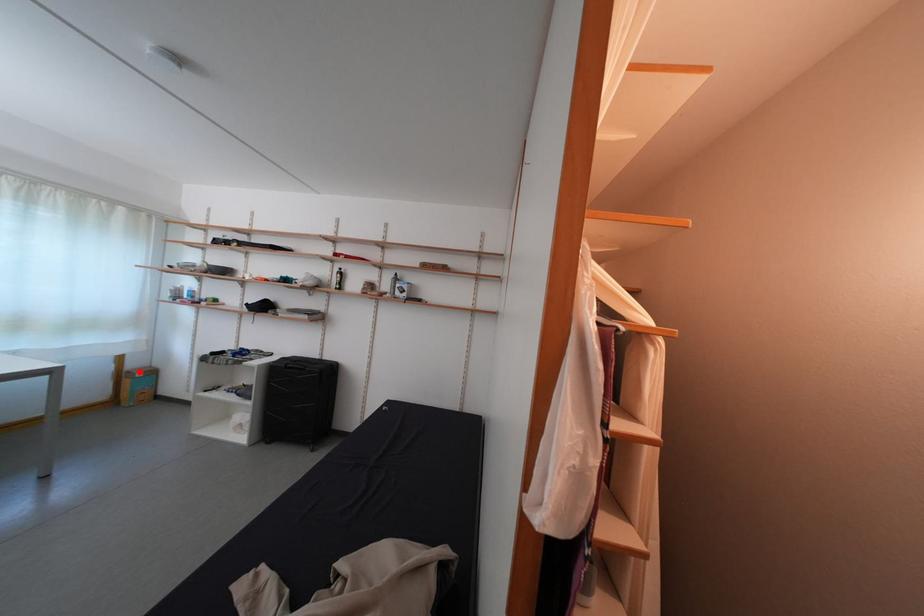
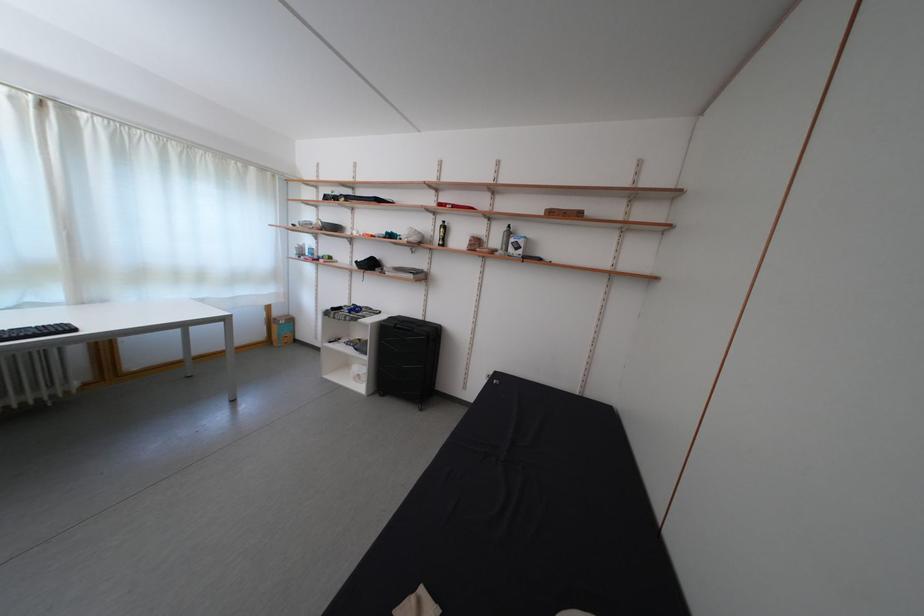
Find the pixel in the second image that matches the highlighted location in the first image.

(285, 320)